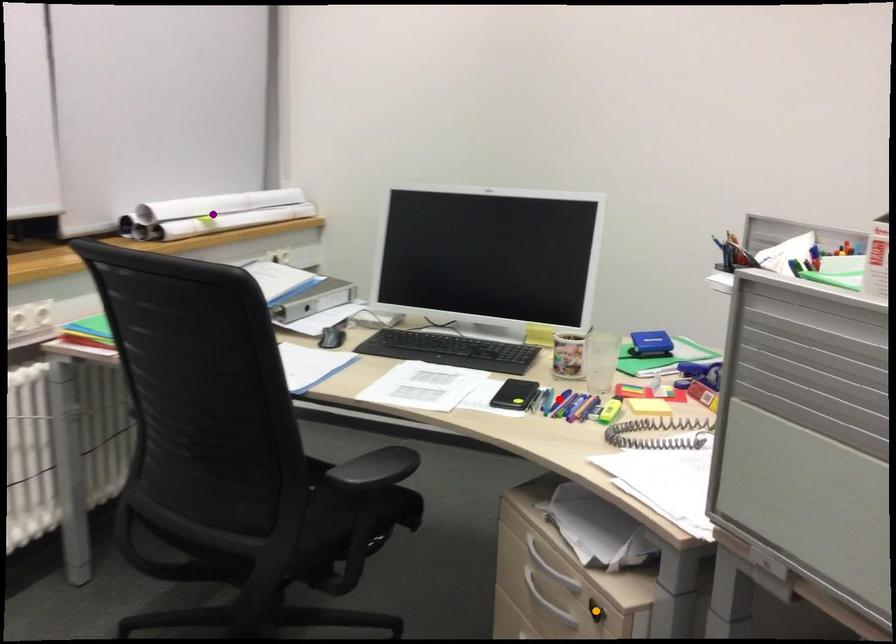
Order these from farthest to nearest:
- red point
- orange point
- purple point

purple point
red point
orange point